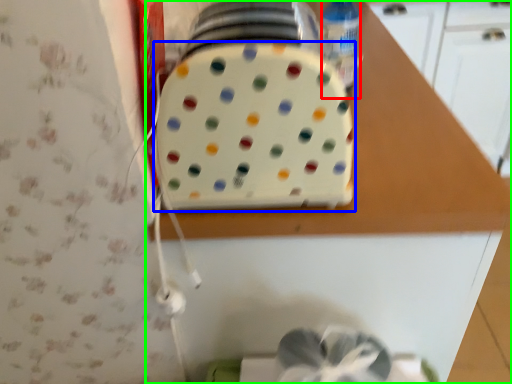
Question: Which is farther away from bottle (highlighted by a red box)? toaster (highlighted by a blue box) or countertop (highlighted by a green box)?

Choices:
 (A) toaster
 (B) countertop

Answer: (B)